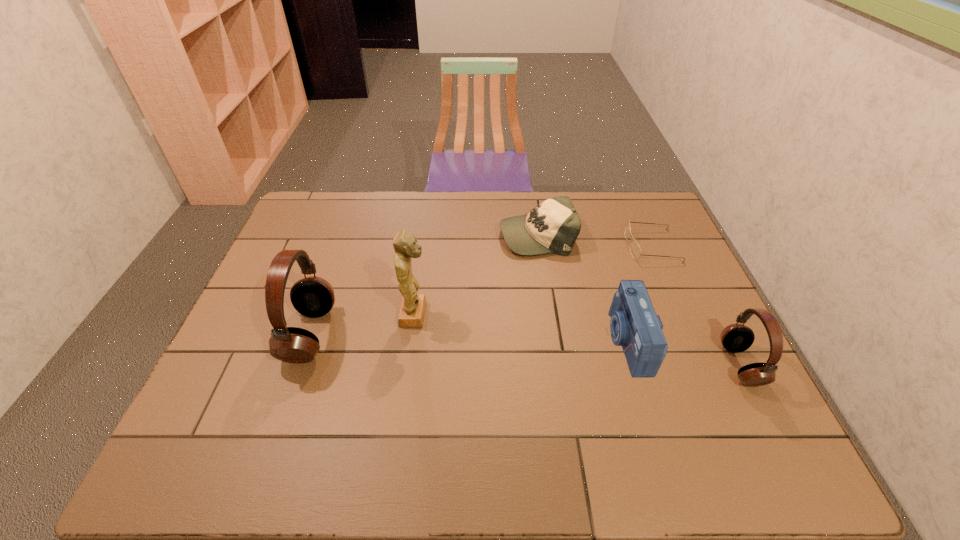
You are a GUI agent. You are given a task and a screenshot of the screen. Output one action in this format:
    pyautogui.click(x=<x>, y=<y>)
    Task: Click on the free spot located on the front-facing side of the fifth object from right to left
    Image resolution: width=960 pixels, height=540 pixels.
    Given the screenshot: What is the action you would take?
    pyautogui.click(x=451, y=314)

This screenshot has width=960, height=540. In order to click on free space located 0.090m on the lens of the camera in this screenshot , I will do `click(576, 341)`.

The height and width of the screenshot is (540, 960). What are the coordinates of `vacant space located 0.180m on the lens of the camera` in the screenshot? It's located at tap(541, 341).

You are a GUI agent. You are given a task and a screenshot of the screen. Output one action in this format:
    pyautogui.click(x=<x>, y=<y>)
    Task: Click on the vacant space situated 0.220m on the lens of the camera
    
    Given the screenshot: What is the action you would take?
    pyautogui.click(x=526, y=341)

The width and height of the screenshot is (960, 540). I want to click on baseball cap present at the far edge, so click(x=553, y=226).

Identify the location of spectacles located in the far edge section of the desktop. Image resolution: width=960 pixels, height=540 pixels. (635, 250).

Find the location of `object located in the near edge section of the desktop`. object located in the near edge section of the desktop is located at coordinates pos(736,337).

Find the location of `object that is at the left edge`. object that is at the left edge is located at coordinates (312, 296).

Locate an element on the screen. This screenshot has height=540, width=960. headset that is at the right edge is located at coordinates (736, 337).

This screenshot has height=540, width=960. Find the location of `spectacles that is at the right edge`. spectacles that is at the right edge is located at coordinates click(635, 250).